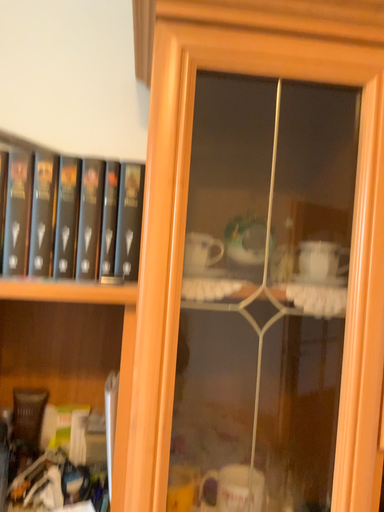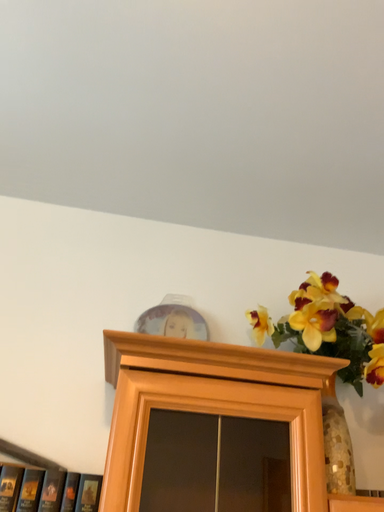
Question: Which way did the camera rotate in the video?

Choices:
 (A) rotated downward
 (B) rotated upward

Answer: (B)